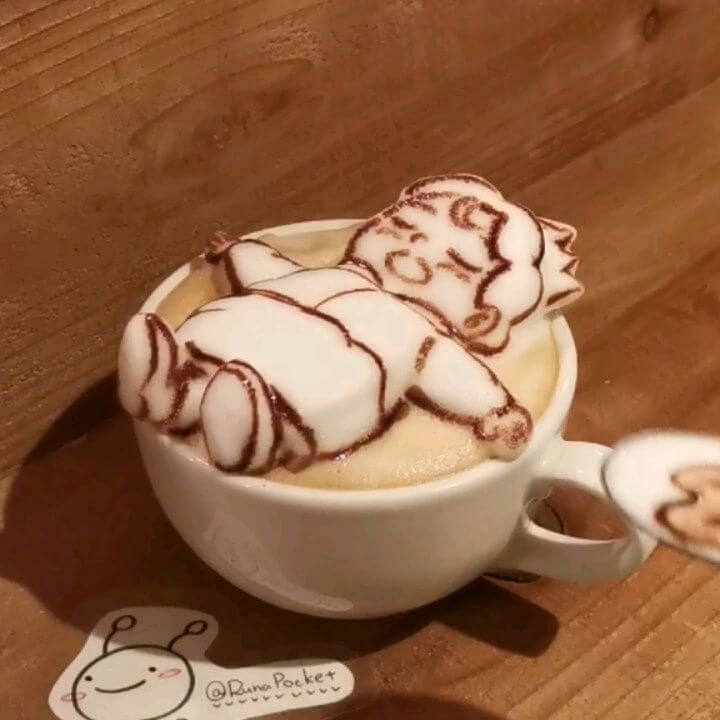
You are a GUI agent. You are given a task and a screenshot of the screen. Output one action in this format:
    pyautogui.click(x=<x>, y=<y>)
    Task: Click on the table
    
    Given the screenshot: What is the action you would take?
    pyautogui.click(x=499, y=660)